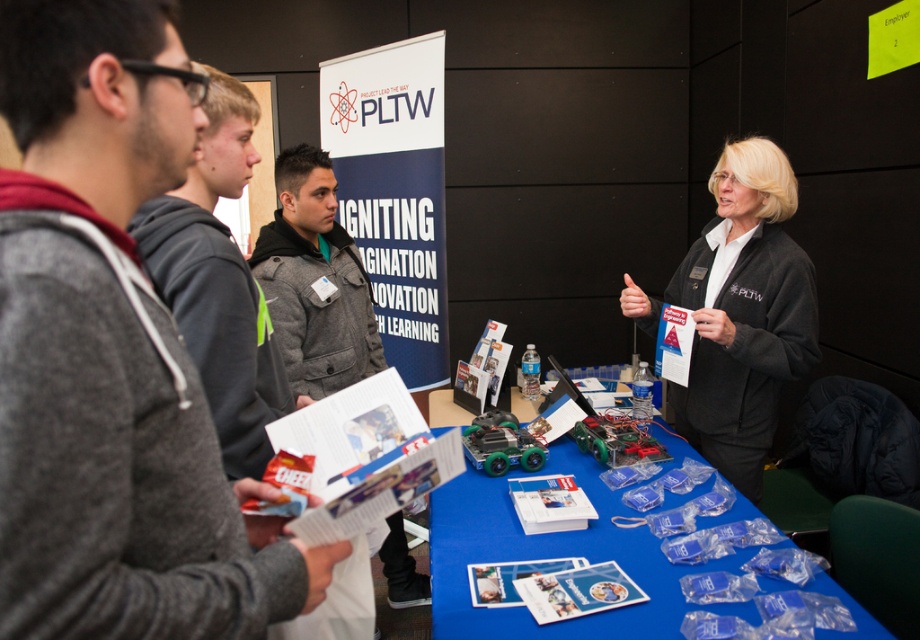
Is gray hoodie at left below gray wool jacket at center?

Yes, gray hoodie at left is below gray wool jacket at center.

Is point (222, 125) positioned in front of point (378, 356)?

Yes, point (222, 125) is closer to viewer.

I want to click on gray hoodie at left, so click(217, 282).

Does black fabric jacket at upper right have a lesser height compared to blue plastic table at center?

In fact, black fabric jacket at upper right may be taller than blue plastic table at center.

Can you confirm if black fabric jacket at upper right is bigger than blue plastic table at center?

Yes, black fabric jacket at upper right is bigger than blue plastic table at center.

Where is `black fabric jacket at upper right`? The image size is (920, 640). black fabric jacket at upper right is located at coordinates click(x=744, y=312).

Measure the distance from black fabric jacket at upper right to gray wool jacket at center.

1.18 meters

Which of these two, black fabric jacket at upper right or gray wool jacket at center, stands taller?

black fabric jacket at upper right

Between point (729, 387) and point (301, 394), which one is positioned in front?

Positioned in front is point (729, 387).

Find the location of a particular element. The height and width of the screenshot is (640, 920). black fabric jacket at upper right is located at coordinates (744, 312).